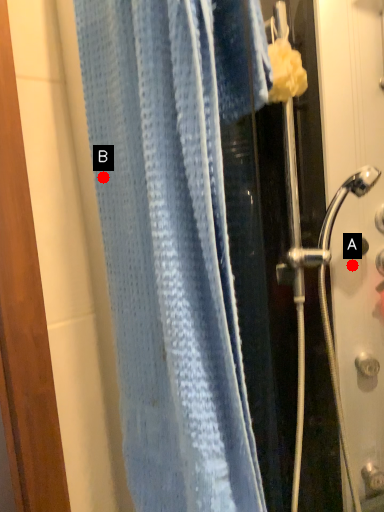
Question: Two points are circled on the image, labeled by A and B beside each circle. Which point is further to the camera?

Choices:
 (A) A is further
 (B) B is further

Answer: (A)